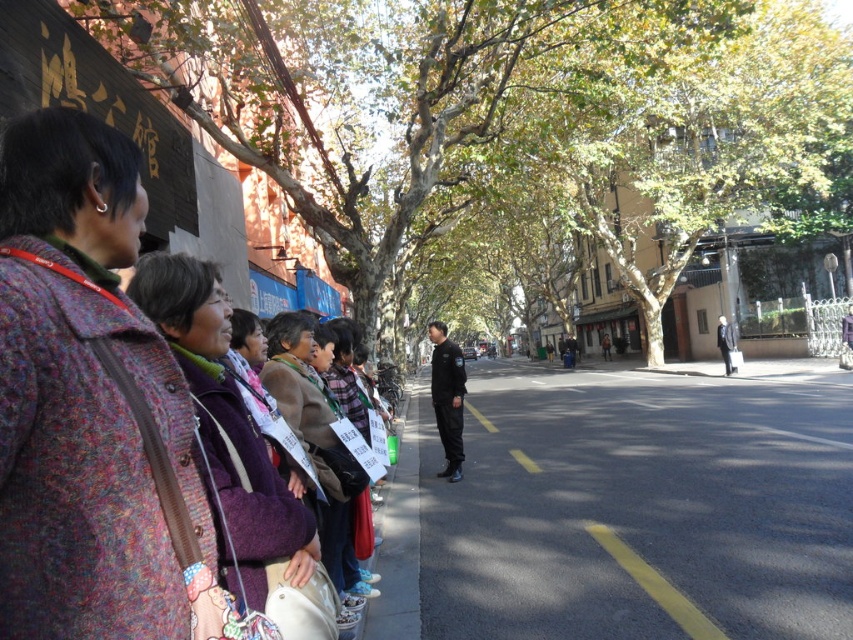
Question: Is multicolored textured coat at left further to the viewer compared to dark blue uniform at center?

Choices:
 (A) yes
 (B) no

Answer: (B)

Question: Is black asphalt pavement at center positioned in front of dark blue uniform at center?

Choices:
 (A) yes
 (B) no

Answer: (A)

Question: Which of the following is the farthest from the observer?

Choices:
 (A) black asphalt pavement at center
 (B) dark blue uniform at center

Answer: (B)

Question: Estimate the real-world distances between objects in this image. Which object is farther from the dark blue uniform at center?

Choices:
 (A) dark gray jacket at center
 (B) multicolored textured coat at left

Answer: (A)

Question: Which point is farther to the camera?

Choices:
 (A) dark blue uniform at center
 (B) dark gray jacket at center
 (C) black asphalt pavement at center
 (D) multicolored textured coat at left

Answer: (B)

Question: Is green leafy tree at upper center to the left of gray concrete curb at lower center from the viewer's perspective?

Choices:
 (A) no
 (B) yes

Answer: (A)